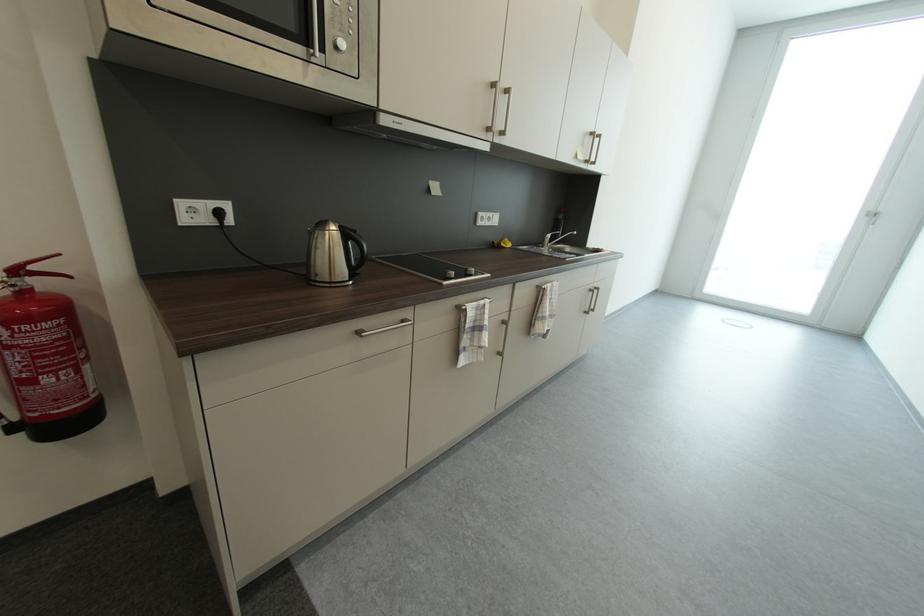
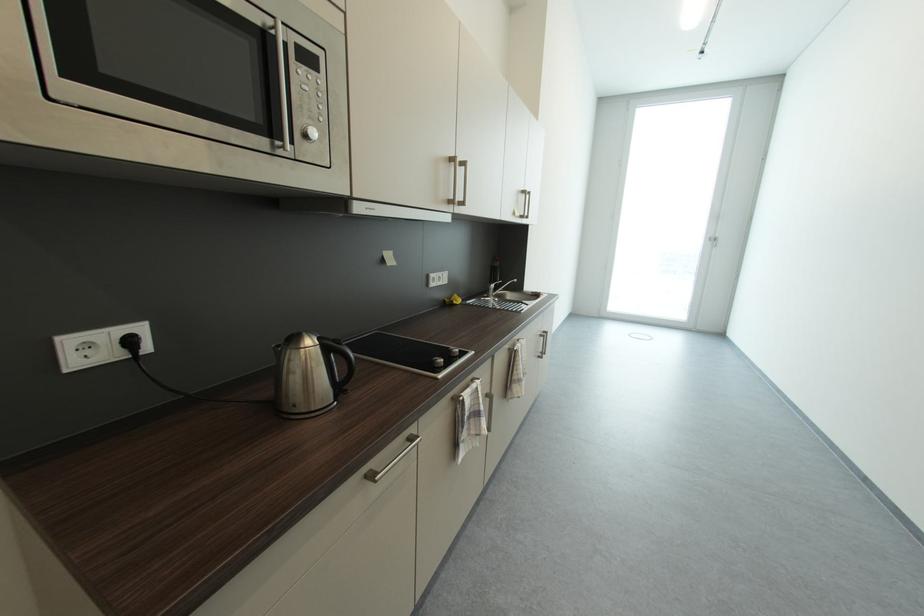
Where in the second image is the point corresponding to point 495,131 from the first image?

(457, 204)